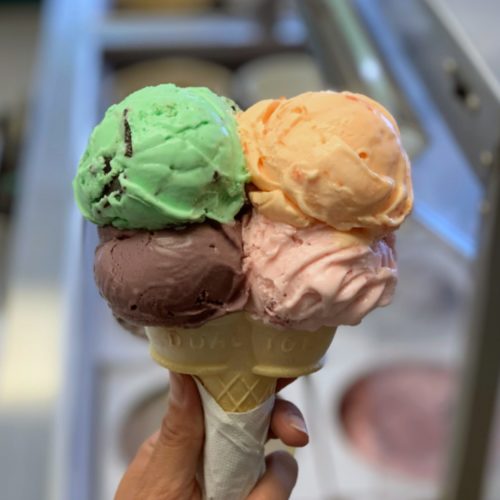
The width and height of the screenshot is (500, 500). I want to click on napkin, so click(x=182, y=260), click(x=179, y=135), click(x=317, y=153), click(x=325, y=262).